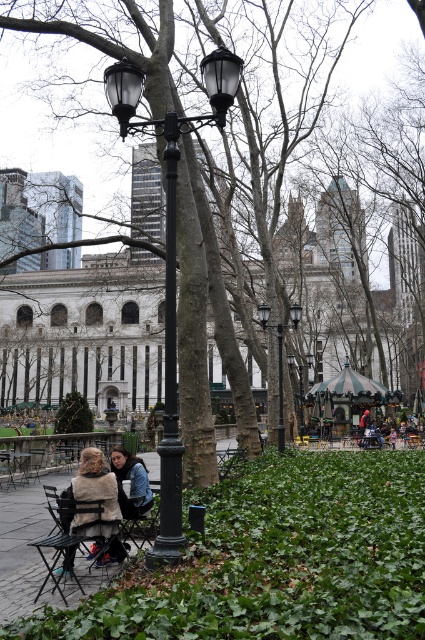
Question: Which point appears farthest from the camera in this image?

Choices:
 (A) (277, 428)
 (B) (280, 330)
 (C) (167, 163)
 (D) (53, 568)

Answer: (A)

Question: Which point is farther to the camera?

Choices:
 (A) black glass street light at center
 (B) black metal pole at center
 (C) black polished metal pole at center
 (D) brown textured tree at center

Answer: (B)

Question: Which object is farther from the camera taking this photo?

Choices:
 (A) matte black street light at center
 (B) black metal chair at lower left
 (C) metallic black chair at lower left
 (D) matte black jacket at lower left

Answer: (A)

Question: Is brown textured tree at center wider than metallic black chair at lower left?

Choices:
 (A) yes
 (B) no

Answer: (A)

Question: Can you confirm if brown textured tree at center is positioned below black glass street light at center?

Choices:
 (A) no
 (B) yes

Answer: (A)

Question: Does black metal pole at center lie behind matte black street light at center?

Choices:
 (A) yes
 (B) no

Answer: (B)